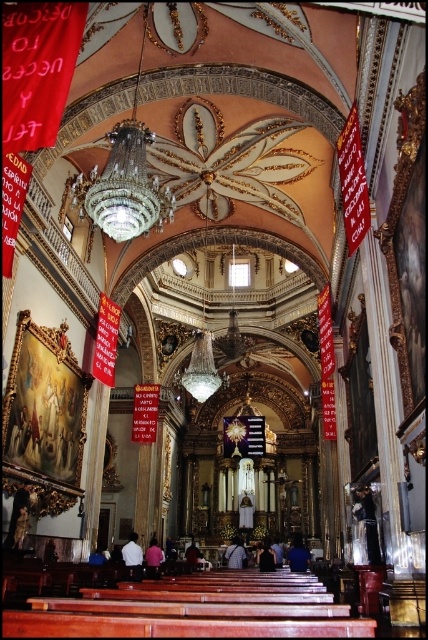
You are standing in the grand church and want to take a photo of the point at coordinates [130,566]. The camera has a maximum focus range of 70 meters. Will you be able to focus on the point?

The distance of point [130,566] from the viewer is 72.00 meters, which exceeds the camera maximum focus range of 70 meters. Therefore, the camera cannot focus on the point.

You are standing in the grand church and notice a white fabric shirt at center. Can you determine its exact location using the coordinate system provided?

The white fabric shirt at center is located at point (x=152, y=557).

Consider the image. You are a photographer planning to take a photo of the dark blue shirt at center and the dark blue fabric at center in the church. To ensure both are visible, you need to know their positions relative to each other. Which one is located lower in the image?

The dark blue shirt at center is below dark blue fabric at center, so the dark blue shirt at center is lower in the image.